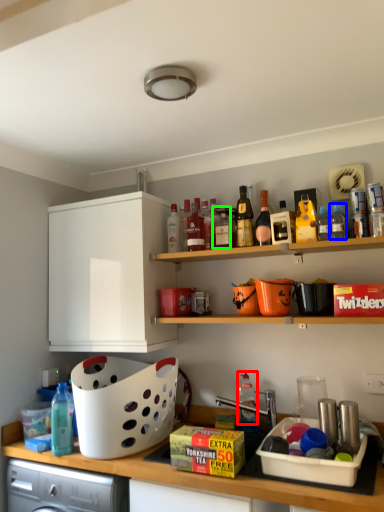
Question: Estimate the real-world distances between objects in this image. Which object is farther from bottle (highlighted by a red box), bottle (highlighted by a blue box) or bottle (highlighted by a green box)?

Choices:
 (A) bottle
 (B) bottle

Answer: (A)